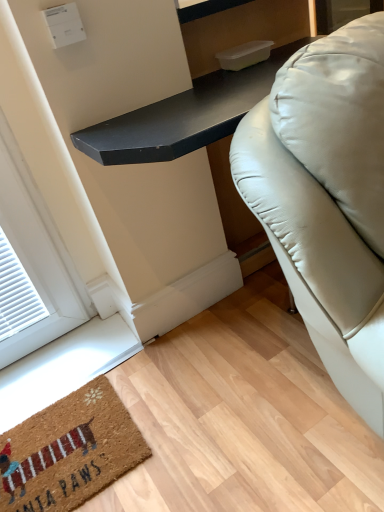
Question: Is black matte table at center wider or thinner than brown coir mat at lower left?

Choices:
 (A) wide
 (B) thin

Answer: (A)

Question: Is black matte table at center in front of or behind brown coir mat at lower left in the image?

Choices:
 (A) behind
 (B) front

Answer: (B)

Question: Considering the positions of black matte table at center and brown coir mat at lower left in the image, is black matte table at center bigger or smaller than brown coir mat at lower left?

Choices:
 (A) big
 (B) small

Answer: (A)

Question: Considering the positions of brown coir mat at lower left and black matte table at center in the image, is brown coir mat at lower left taller or shorter than black matte table at center?

Choices:
 (A) short
 (B) tall

Answer: (A)

Question: Is point click(x=29, y=417) closer or farther from the camera than point click(x=213, y=121)?

Choices:
 (A) closer
 (B) farther

Answer: (B)

Question: Considering the positions of brown coir mat at lower left and black matte table at center in the image, is brown coir mat at lower left wider or thinner than black matte table at center?

Choices:
 (A) wide
 (B) thin

Answer: (B)

Question: Considering their positions, is brown coir mat at lower left located in front of or behind black matte table at center?

Choices:
 (A) front
 (B) behind

Answer: (B)